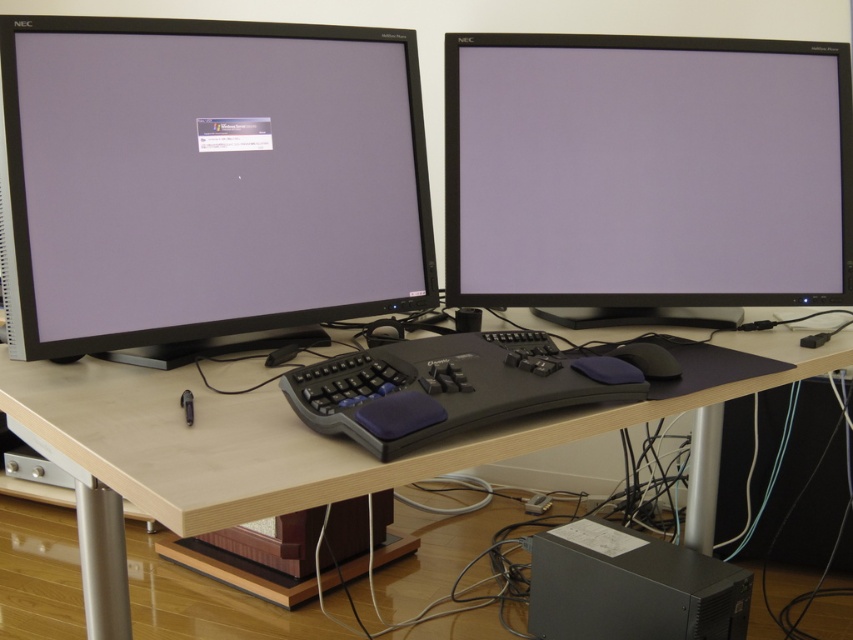
Between matte black monitor at upper right and light wood table at center, which one has more height?

Standing taller between the two is matte black monitor at upper right.

Between matte black monitor at upper right and light wood table at center, which one has less height?

With less height is light wood table at center.

Which is behind, point (634, 58) or point (163, 403)?

Positioned behind is point (634, 58).

I want to click on matte black monitor at upper right, so click(646, 170).

Does matte black monitor at upper right have a lesser width compared to black plastic computer at lower center?

No, matte black monitor at upper right is not thinner than black plastic computer at lower center.

This screenshot has height=640, width=853. What do you see at coordinates (646, 170) in the screenshot? I see `matte black monitor at upper right` at bounding box center [646, 170].

Describe the element at coordinates (646, 170) in the screenshot. I see `matte black monitor at upper right` at that location.

Locate an element on the screen. The width and height of the screenshot is (853, 640). matte black monitor at upper right is located at coordinates (646, 170).

Is black plastic computer at lower center bigger than black rubber mouse at center?

Indeed, black plastic computer at lower center has a larger size compared to black rubber mouse at center.

Locate an element on the screen. The width and height of the screenshot is (853, 640). black plastic computer at lower center is located at coordinates (630, 588).

The height and width of the screenshot is (640, 853). I want to click on black plastic computer at lower center, so click(x=630, y=588).